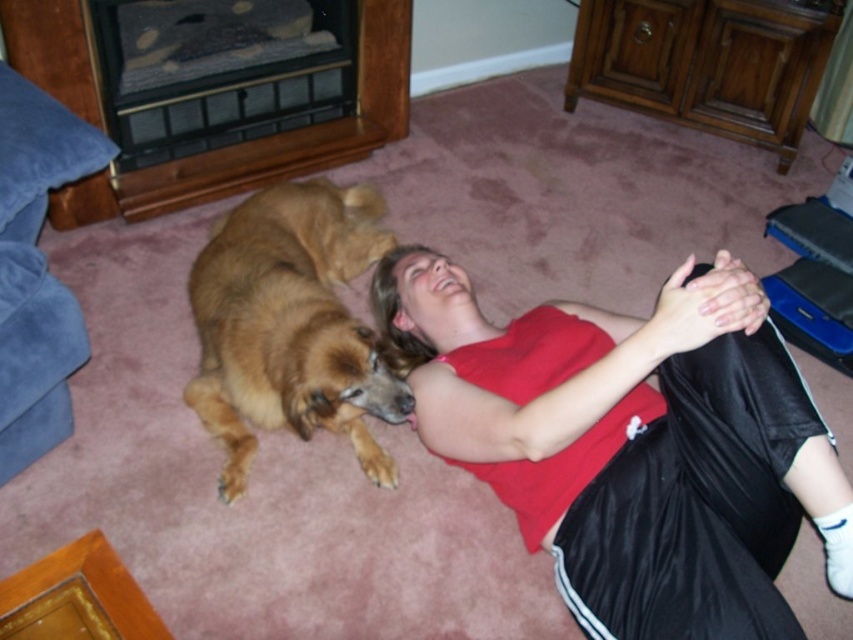
Question: Is matte red tank top at center further to camera compared to golden fur dog at center?

Choices:
 (A) yes
 (B) no

Answer: (B)

Question: Which point is farther to the camera?

Choices:
 (A) (590, 529)
 (B) (222, 403)

Answer: (B)

Question: Which object appears farthest from the camera in this image?

Choices:
 (A) matte red tank top at center
 (B) golden fur dog at center

Answer: (B)

Question: Does matte red tank top at center have a lesser width compared to golden fur dog at center?

Choices:
 (A) yes
 (B) no

Answer: (B)

Question: Considering the relative positions of matte red tank top at center and golden fur dog at center in the image provided, where is matte red tank top at center located with respect to golden fur dog at center?

Choices:
 (A) above
 (B) below

Answer: (B)

Question: Which of the following is the closest to the observer?

Choices:
 (A) (537, 536)
 (B) (225, 284)

Answer: (A)